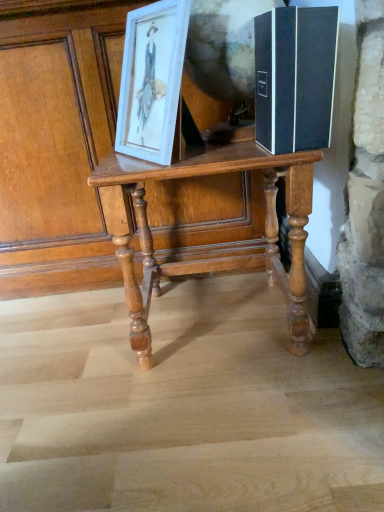
Find the location of a particular element. free space to the left of black matte book at right is located at coordinates (220, 154).